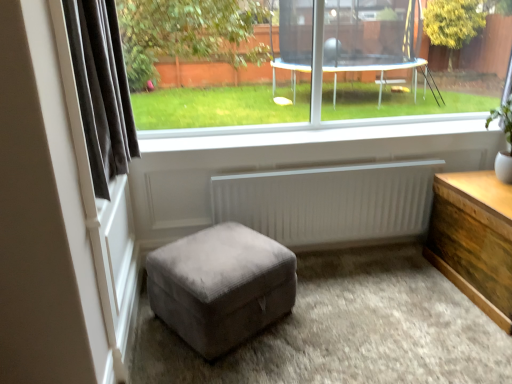
Question: Relative to dark grey fabric curtain at left, is suede ottoman at center in front or behind?

Choices:
 (A) behind
 (B) front

Answer: (A)

Question: Which is correct: suede ottoman at center is inside dark grey fabric curtain at left, or outside of it?

Choices:
 (A) inside
 (B) outside

Answer: (B)

Question: Which object is the closest to the white smooth window sill at center?

Choices:
 (A) white ribbed radiator at center
 (B) transparent glass window at center
 (C) wooden chest at right
 (D) dark grey fabric curtain at left
 (E) suede ottoman at center

Answer: (A)

Question: Which object is the farthest from the white smooth window sill at center?

Choices:
 (A) white ribbed radiator at center
 (B) suede ottoman at center
 (C) dark grey fabric curtain at left
 (D) wooden chest at right
 (E) transparent glass window at center

Answer: (E)